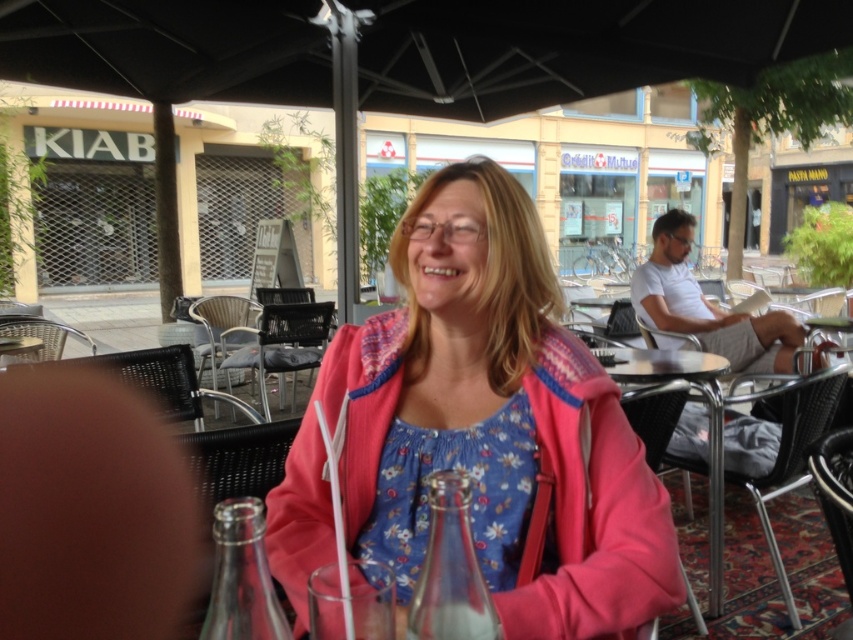
Based on the photo, you are a customer at the outdoor cafe and want to sit down. You see the pink fleece jacket at center and the metallic silver table at center. Which object is closer to you as you approach the table?

The pink fleece jacket at center is closer to you because it is in front of the metallic silver table at center.

You are standing at the point labeled as point [718,492] and want to walk towards the point labeled as point [457,269]. Which direction should you face to move directly towards your destination?

To move directly from point [718,492] to point [457,269], you should face towards the northwest direction since point [457,269] is located in front of point [718,492].